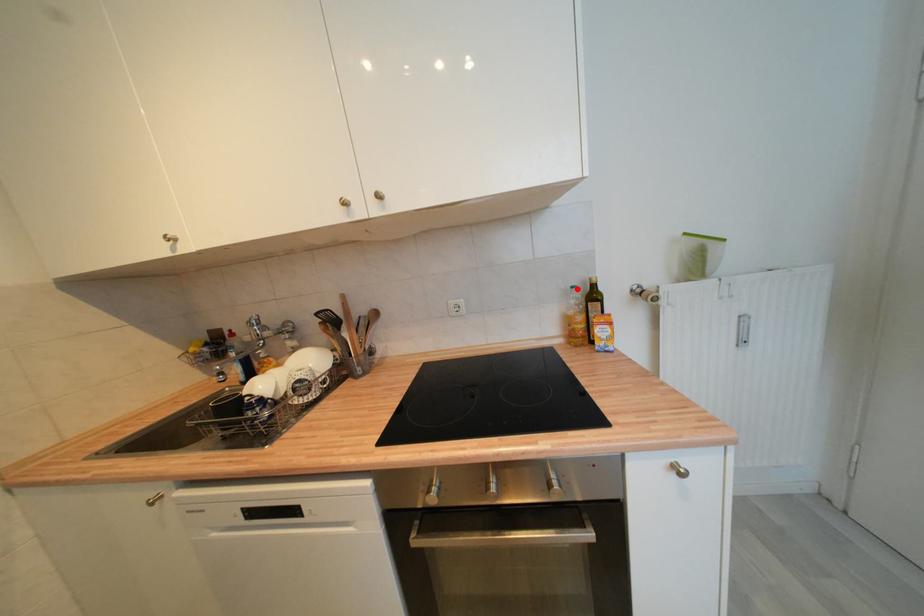
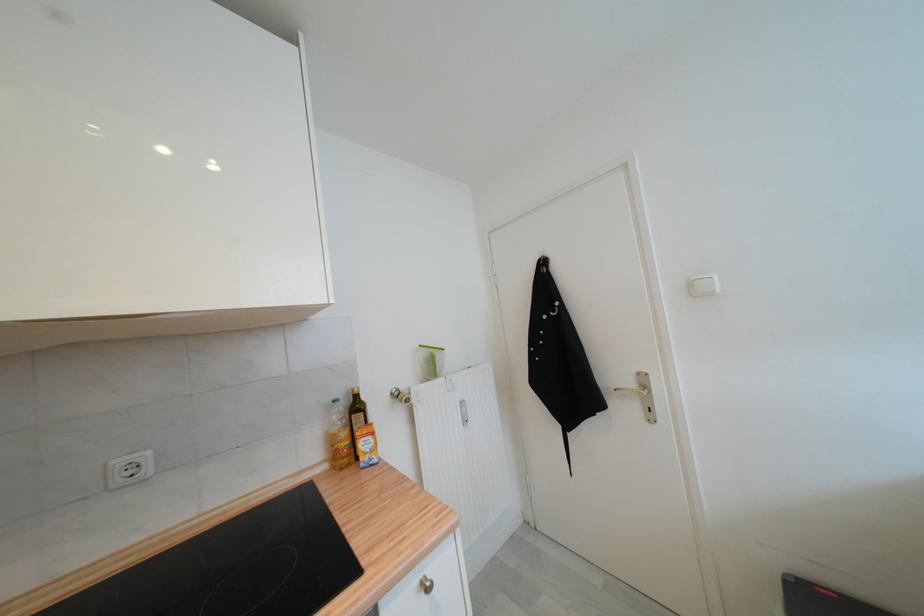
Find the pixel in the second image that matches the highlighted location in the first image.

(339, 403)